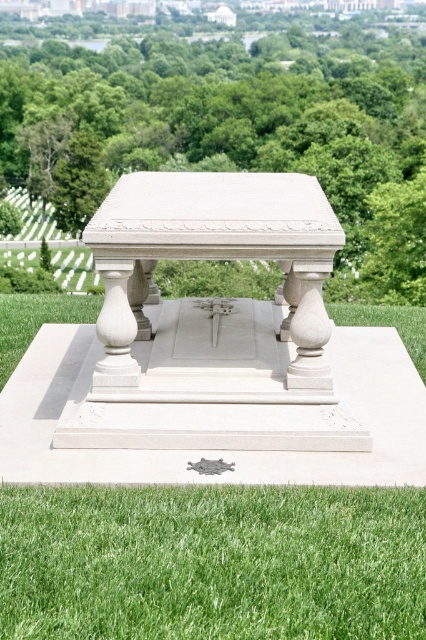
Between white stone bench at center and green grass at lower center, which one appears on the left side from the viewer's perspective?

Positioned to the left is green grass at lower center.

The width and height of the screenshot is (426, 640). In order to click on white stone bench at center in this screenshot , I will do `click(230, 116)`.

Who is more forward, [40,97] or [141,586]?

Point [141,586] is more forward.

You are a GUI agent. You are given a task and a screenshot of the screen. Output one action in this format:
    pyautogui.click(x=<x>, y=<y>)
    Task: Click on the white stone bench at center
    This screenshot has height=640, width=426.
    Given the screenshot: What is the action you would take?
    pyautogui.click(x=230, y=116)